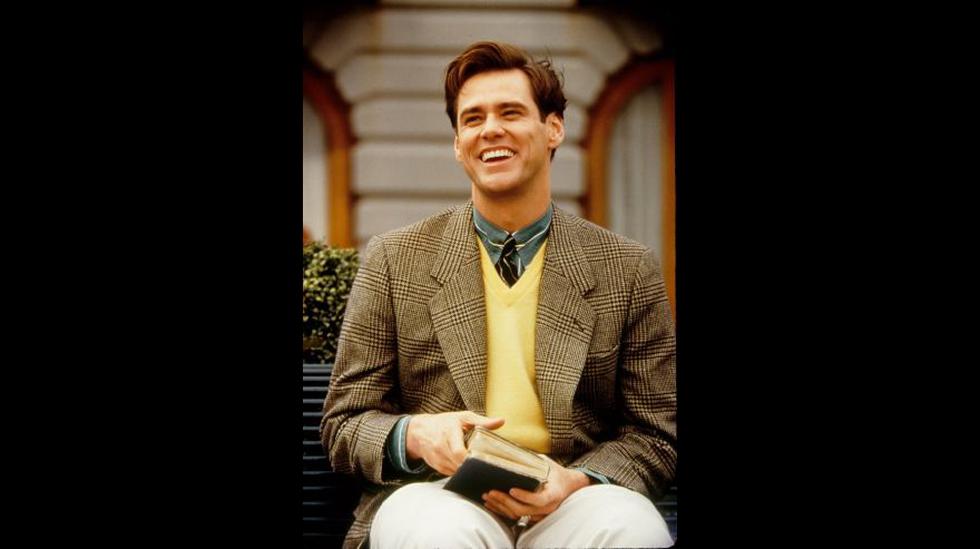
In order to click on book in this screenshot , I will do `click(509, 453)`.